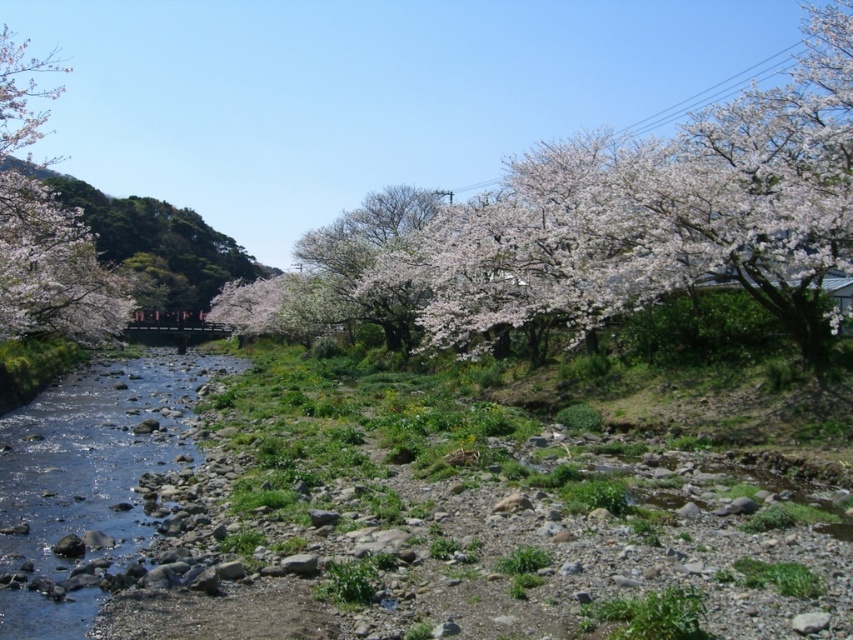
Question: Is white blossoming tree at upper center above white blossoming tree at left?

Choices:
 (A) no
 (B) yes

Answer: (A)

Question: Among these objects, which one is farthest from the camera?

Choices:
 (A) white blossoming tree at upper center
 (B) clear water at river left

Answer: (A)

Question: From the image, what is the correct spatial relationship of clear water at river left in relation to white blossoming tree at left?

Choices:
 (A) below
 (B) above

Answer: (A)

Question: Which is nearer to the white blossoming tree at upper center?

Choices:
 (A) clear water at river left
 (B) white blossoming tree at left

Answer: (A)

Question: Which of the following is the farthest from the observer?

Choices:
 (A) (845, 0)
 (B) (86, 618)
 (C) (1, 177)

Answer: (A)

Question: Does white blossoming tree at upper center lie in front of white blossoming tree at left?

Choices:
 (A) yes
 (B) no

Answer: (A)